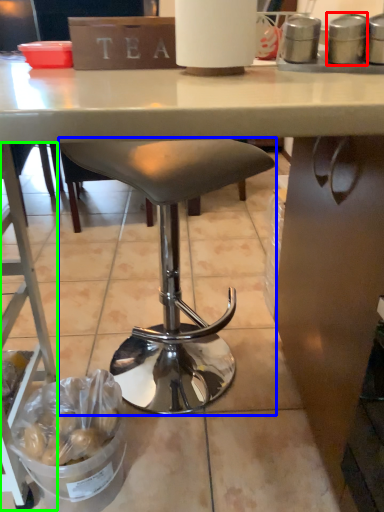
Question: Based on their relative distances, which object is nearer to appliance (highlighted by a red box)? Choose from stool (highlighted by a blue box) and ladder (highlighted by a green box).

Choices:
 (A) stool
 (B) ladder

Answer: (A)